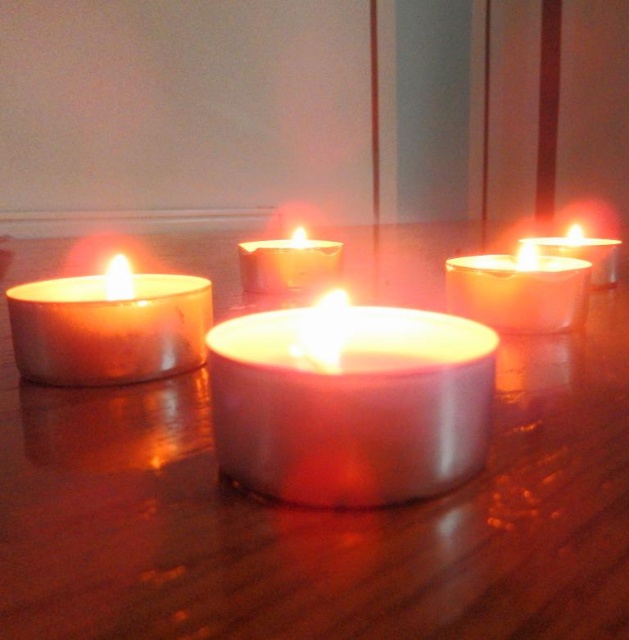
You are planning to place a new candle holder that is the same size as the matte white candle at upper right on the table. Based on the scene, will the metallic silver candle at center block the new candle holder from being placed directly to its right?

The metallic silver candle at center is larger in size than the matte white candle at upper right. Since the new candle holder is the same size as the matte white candle at upper right, it might fit next to the metallic silver candle at center without being blocked, but the exact placement depends on the available space around the larger candle.

You are arranging flowers on a table and need to place a vase between the metallic silver candle at center and the matte silver candle at left. According to the scene description, where should you position the vase?

The metallic silver candle at center is located below the matte silver candle at left, so you should place the vase between them by positioning it above the metallic silver candle at center and below the matte silver candle at left.

You are holding a small toy that is 10 inches long. You want to place it on the table so that it points directly toward the satin white candle at center. Can the toy reach the candle from your current position without moving?

The satin white candle at center is 12.41 inches away from the viewer. Since the toy is only 10 inches long, it cannot reach the candle from your current position.